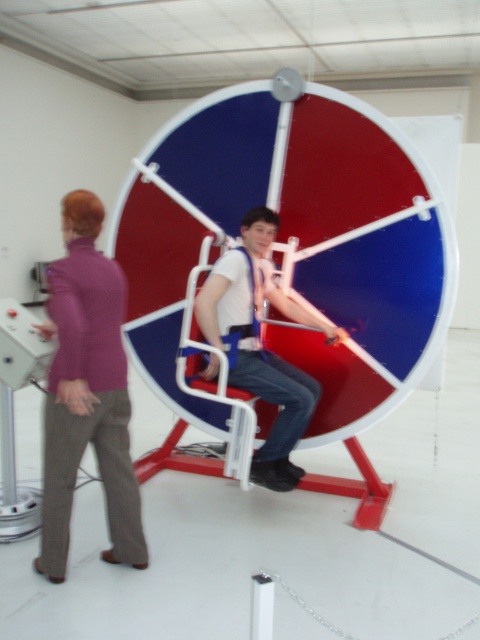
Question: Does matte purple shirt at left appear under white fabric harness at center?

Choices:
 (A) yes
 (B) no

Answer: (A)

Question: Can you confirm if matte purple shirt at left is positioned to the left of white fabric harness at center?

Choices:
 (A) yes
 (B) no

Answer: (A)

Question: Which point is closer to the camera?

Choices:
 (A) (239, 278)
 (B) (68, 484)

Answer: (B)

Question: Which object is closer to the camera taking this photo?

Choices:
 (A) matte purple shirt at left
 (B) white fabric harness at center

Answer: (A)

Question: Which point appears closest to the camera in this image?

Choices:
 (A) (301, 474)
 (B) (119, 493)

Answer: (B)

Question: Does matte purple shirt at left have a smaller size compared to white fabric harness at center?

Choices:
 (A) yes
 (B) no

Answer: (A)